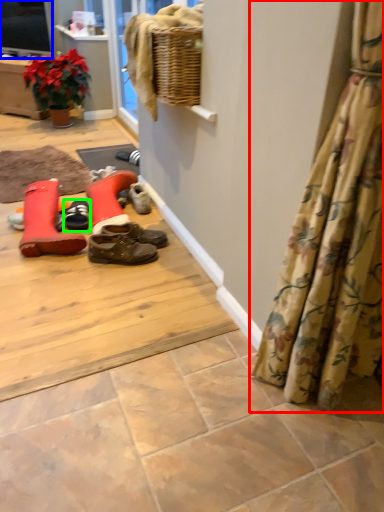
Question: Which object is the closest to the curtain (highlighted by a red box)? Choose among these: television (highlighted by a blue box) or footwear (highlighted by a green box).

Choices:
 (A) television
 (B) footwear

Answer: (B)